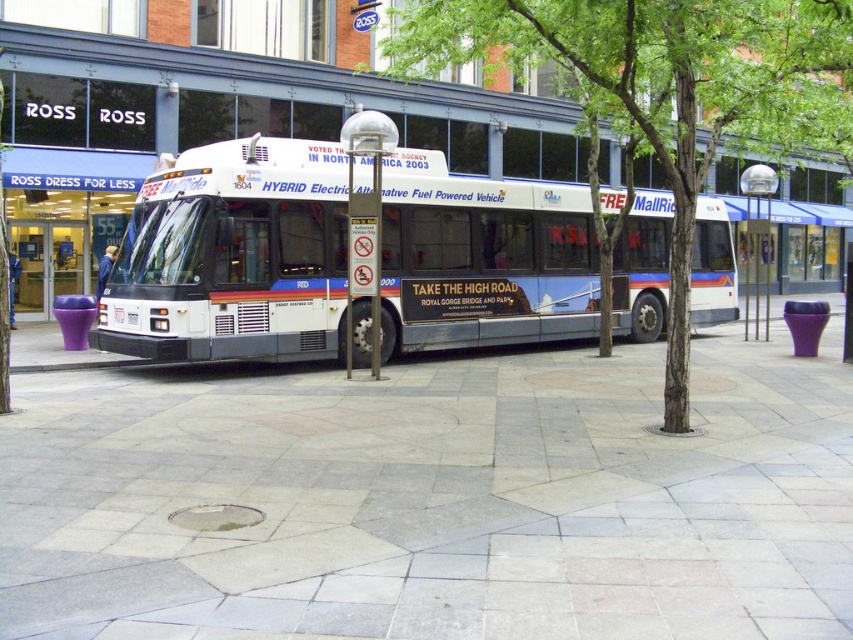
Question: Which of the following is the closest to the observer?

Choices:
 (A) (811, 65)
 (B) (811, 428)

Answer: (B)

Question: From the image, what is the correct spatial relationship of gray stone pavement at center in relation to green leafy tree at center?

Choices:
 (A) below
 (B) above

Answer: (A)

Question: Observing the image, what is the correct spatial positioning of gray stone pavement at center in reference to white matte bus at center?

Choices:
 (A) right
 (B) left

Answer: (B)

Question: Does gray stone pavement at center have a smaller size compared to white matte bus at center?

Choices:
 (A) no
 (B) yes

Answer: (B)

Question: Estimate the real-world distances between objects in this image. Which object is closer to the gray stone pavement at center?

Choices:
 (A) green leafy tree at center
 (B) white matte bus at center

Answer: (B)

Question: Which point is closer to the camera taking this photo?

Choices:
 (A) (670, 252)
 (B) (788, 444)

Answer: (B)